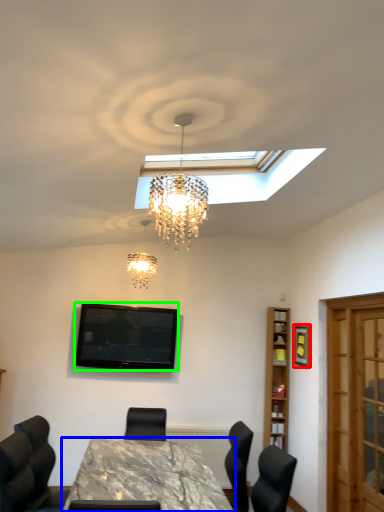
Question: Estimate the real-world distances between objects in this image. Which object is closer to picture frame (highlighted by a red box), table (highlighted by a blue box) or television (highlighted by a green box)?

Choices:
 (A) table
 (B) television

Answer: (B)